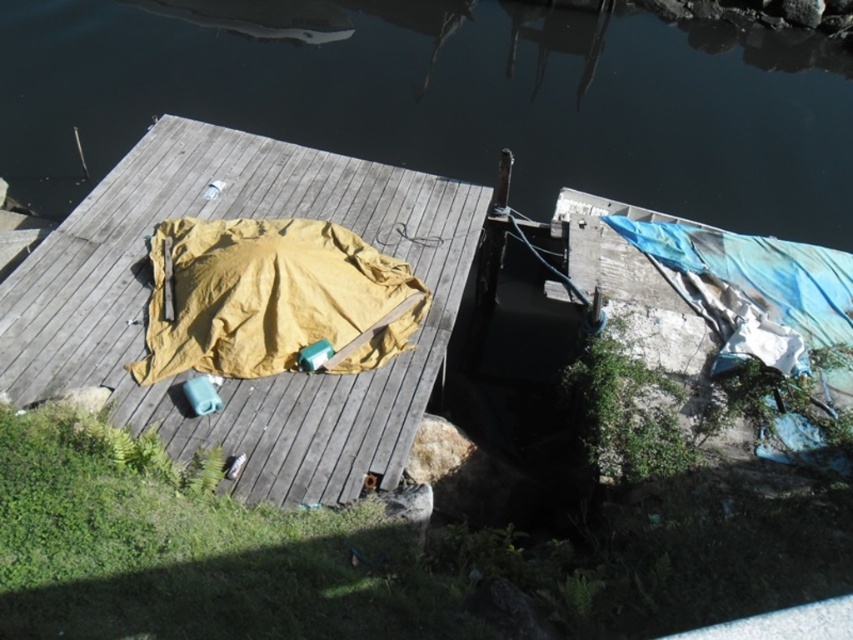
You are a dock inspector checking the condition of the dock. You notice two items at the center of the dock, a matte yellow tarp at center and a yellow fabric blanket at center. Which one is closer to you as you stand on the dock?

The matte yellow tarp at center is in front of the yellow fabric blanket at center, so the matte yellow tarp at center is closer to you.

You are standing on the wooden dock and want to place a small potted plant between the transparent water at upper center and the yellow fabric blanket at center. Which object should you place it closer to if you want the plant to be near the larger area?

You should place the small potted plant closer to the transparent water at upper center because it is larger than the yellow fabric blanket at center.